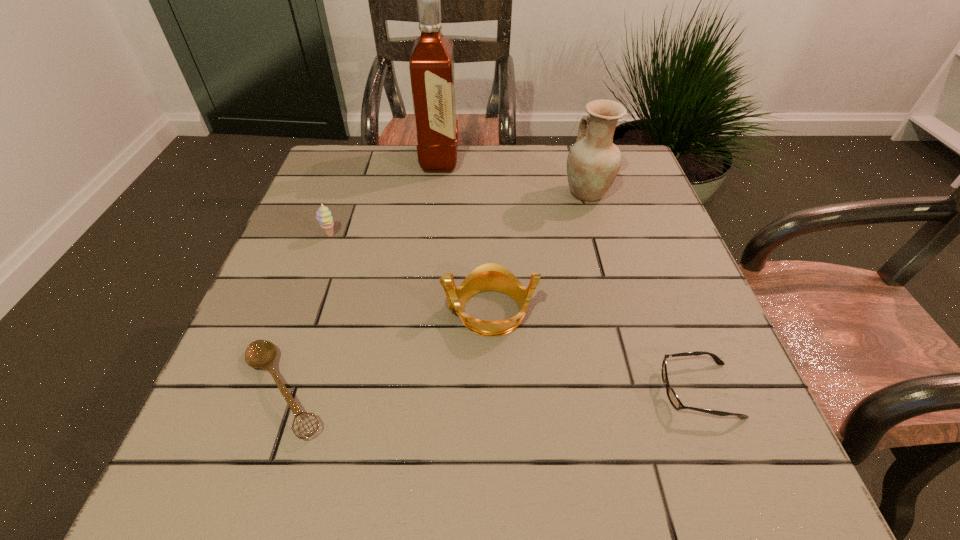
This screenshot has width=960, height=540. What are the coordinates of `free space located on the left of the pottery` in the screenshot? It's located at (532, 193).

Find the location of `blank space located 0.210m at the front emblem of the third nearest object`. blank space located 0.210m at the front emblem of the third nearest object is located at coordinates (336, 311).

At what (x,y) coordinates should I click in order to perform the action: click on vacant space located 0.180m at the front emblem of the third nearest object. Please return your answer as a coordinate pair (x, y). The width and height of the screenshot is (960, 540). Looking at the image, I should click on (351, 311).

Image resolution: width=960 pixels, height=540 pixels. Find the location of `vacant area situated at the front emblem of the third nearest object`. vacant area situated at the front emblem of the third nearest object is located at coordinates (330, 311).

Identify the location of vacant area situated 0.080m on the left of the third farthest object. (288, 236).

Where is `free space located 0.390m on the front-facing side of the spectacles`? free space located 0.390m on the front-facing side of the spectacles is located at coordinates (432, 390).

Where is `free location located 0.150m on the front-facing side of the spectacles`? free location located 0.150m on the front-facing side of the spectacles is located at coordinates click(573, 390).

What are the coordinates of `vacant position located 0.350m on the front-facing side of the spectacles` in the screenshot? It's located at point(455,390).

This screenshot has height=540, width=960. Find the location of `vacant space located on the back of the ladle`. vacant space located on the back of the ladle is located at coordinates point(320,285).

At what (x,y) coordinates should I click in order to perform the action: click on liquor that is at the far edge. Please return your answer as a coordinate pair (x, y). Image resolution: width=960 pixels, height=540 pixels. Looking at the image, I should click on (432, 72).